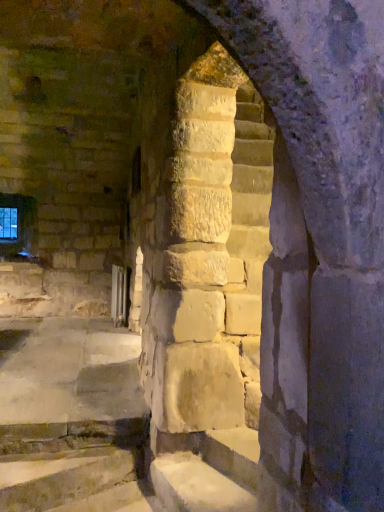
Question: Would you say smooth stone stairs at center is inside or outside transparent glass window at upper left?

Choices:
 (A) outside
 (B) inside

Answer: (A)

Question: From a real-world perspective, relative to transparent glass window at upper left, is smooth stone stairs at center vertically above or below?

Choices:
 (A) below
 (B) above

Answer: (A)

Question: Considering the positions of smooth stone stairs at center and transparent glass window at upper left in the image, is smooth stone stairs at center wider or thinner than transparent glass window at upper left?

Choices:
 (A) thin
 (B) wide

Answer: (B)

Question: Is transparent glass window at upper left in front of or behind smooth stone stairs at center in the image?

Choices:
 (A) behind
 (B) front

Answer: (A)

Question: Considering the positions of point (0, 218) and point (243, 444), is point (0, 218) closer or farther from the camera than point (243, 444)?

Choices:
 (A) closer
 (B) farther

Answer: (B)

Question: Do you think transparent glass window at upper left is within smooth stone stairs at center, or outside of it?

Choices:
 (A) inside
 (B) outside

Answer: (B)

Question: Is transparent glass window at upper left taller or shorter than smooth stone stairs at center?

Choices:
 (A) short
 (B) tall

Answer: (B)